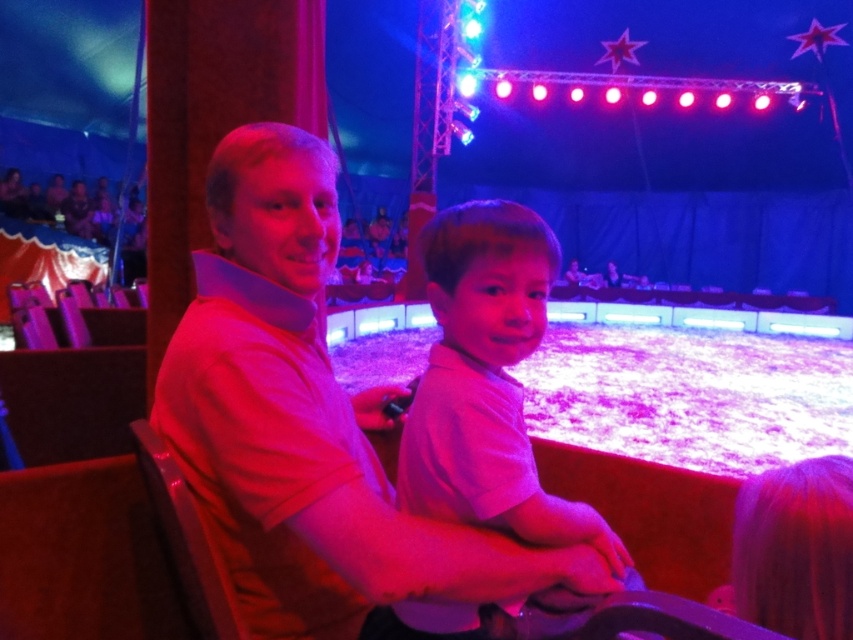
Can you confirm if matte pink shirt at center is shorter than pink cotton shirt at center?

No.

Is matte pink shirt at center closer to camera compared to pink cotton shirt at center?

Yes, it is.

Is point (229, 500) behind point (549, 538)?

Yes, it is.

Locate an element on the screen. matte pink shirt at center is located at coordinates click(x=306, y=424).